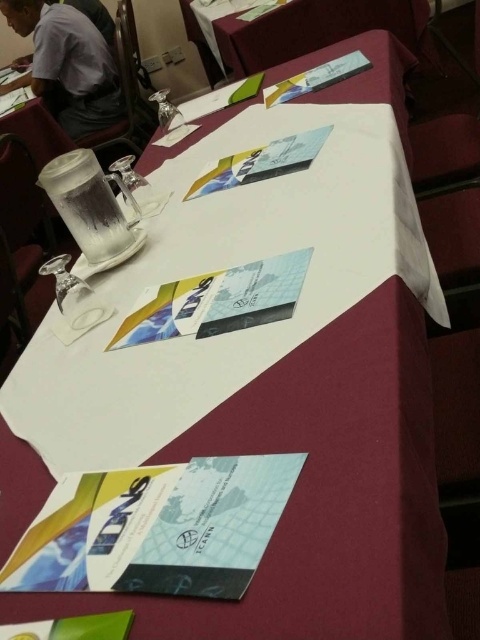
Question: Can you confirm if white paper at upper center is positioned above gray fabric shirt at upper left?

Choices:
 (A) yes
 (B) no

Answer: (B)

Question: Does white paper at upper center come in front of gray fabric shirt at upper left?

Choices:
 (A) yes
 (B) no

Answer: (A)

Question: Which point is closer to the camera taking this photo?

Choices:
 (A) (82, 113)
 (B) (417, 8)

Answer: (B)

Question: Is white paper at upper center smaller than gray fabric shirt at upper left?

Choices:
 (A) yes
 (B) no

Answer: (B)

Question: Which of the following is the closest to the observer?

Choices:
 (A) (432, 51)
 (B) (6, 90)

Answer: (A)